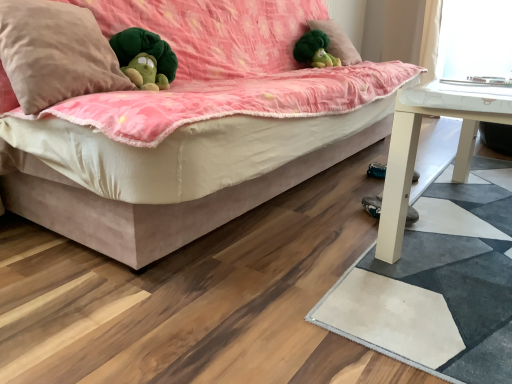
This screenshot has height=384, width=512. What are the coordinates of `unoccupied space behind black suede shoe at lower right` in the screenshot? It's located at (368, 193).